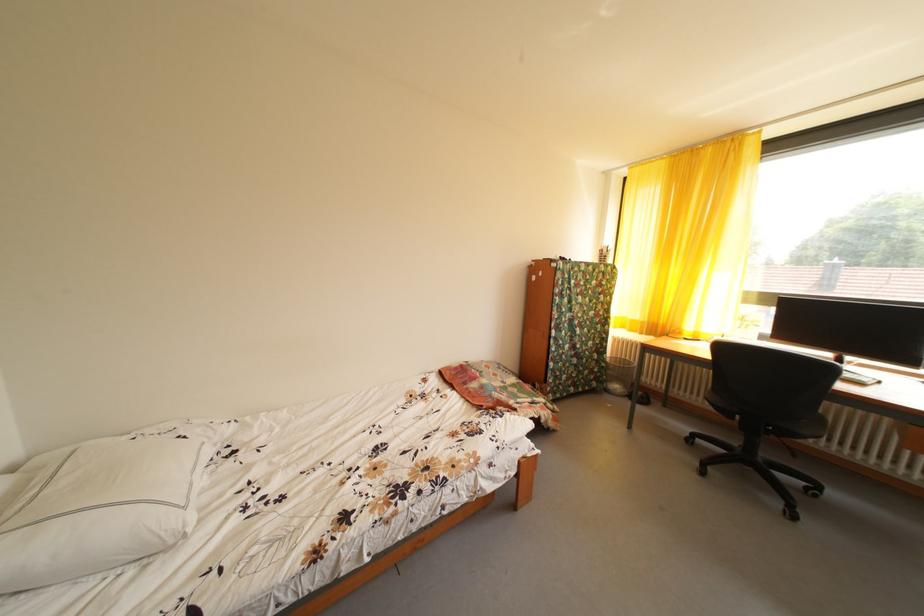
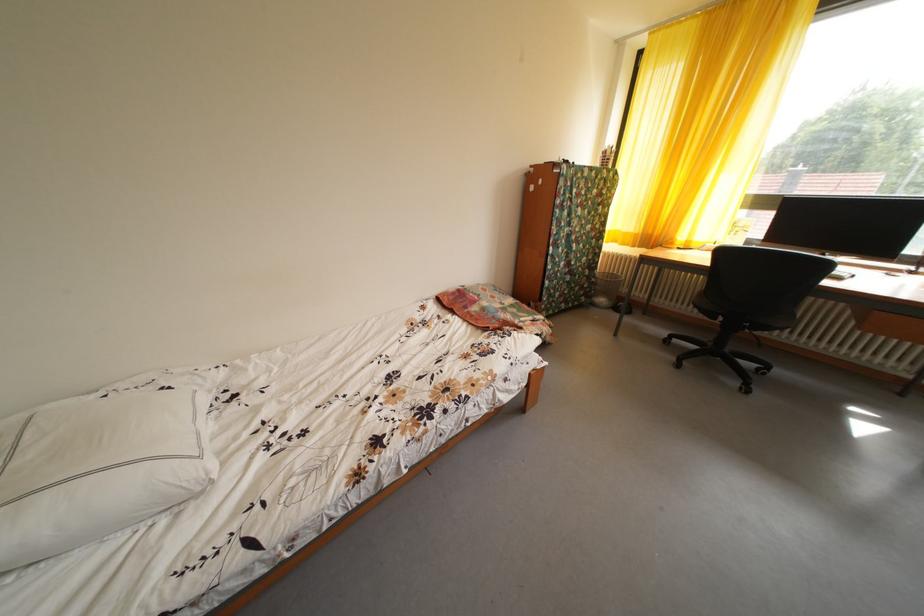
The point at (159,437) is marked in the first image. Where is the corresponding point in the second image?

(131, 391)